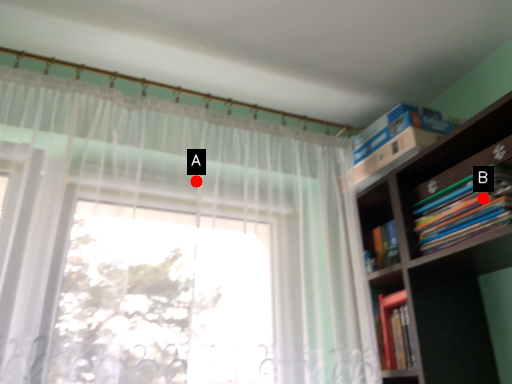
Question: Two points are circled on the image, labeled by A and B beside each circle. Which point appears farthest from the camera in this image?

Choices:
 (A) A is further
 (B) B is further

Answer: (A)